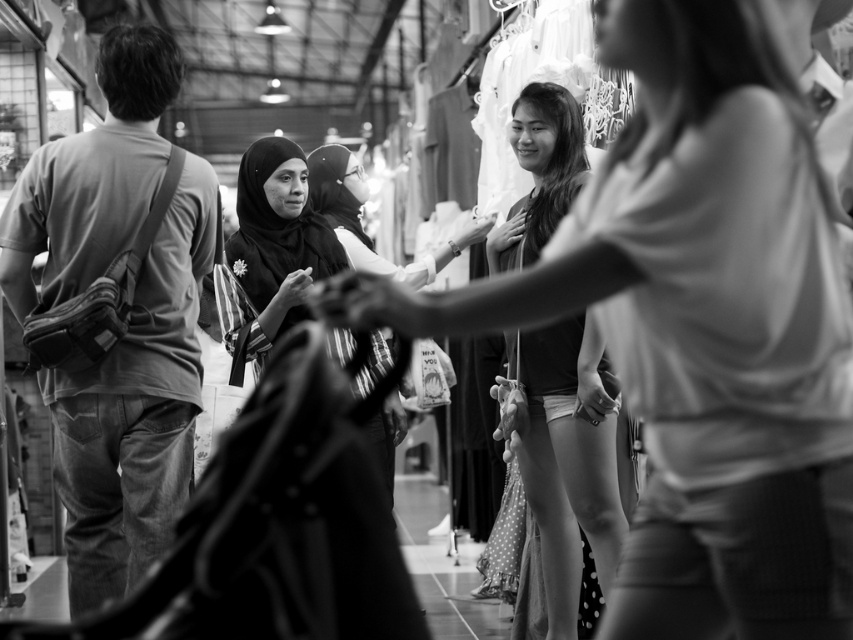
Is denim jeans at left below smooth fabric blouse at center?

Actually, denim jeans at left is above smooth fabric blouse at center.

What do you see at coordinates (136, 410) in the screenshot?
I see `denim jeans at left` at bounding box center [136, 410].

Is point (80, 212) closer to camera compared to point (590, 432)?

Yes, point (80, 212) is closer to viewer.

Where is `denim jeans at left`? The width and height of the screenshot is (853, 640). denim jeans at left is located at coordinates point(136,410).

Can you confirm if smooth fabric blouse at center is shorter than matte black hijab at center?

In fact, smooth fabric blouse at center may be taller than matte black hijab at center.

Who is positioned more to the right, smooth fabric blouse at center or matte black hijab at center?

Positioned to the right is smooth fabric blouse at center.

What do you see at coordinates (569, 468) in the screenshot? The height and width of the screenshot is (640, 853). I see `smooth fabric blouse at center` at bounding box center [569, 468].

You are a GUI agent. You are given a task and a screenshot of the screen. Output one action in this format:
    pyautogui.click(x=<x>, y=<y>)
    Task: Click on the smooth fabric blouse at center
    The width and height of the screenshot is (853, 640).
    Given the screenshot: What is the action you would take?
    [x=569, y=468]

Between denim jeans at left and matte black hijab at center, which one is positioned higher?

matte black hijab at center is above.

Does denim jeans at left have a greater width compared to matte black hijab at center?

Yes.

Between point (117, 400) and point (285, 262), which one is positioned in front?

Point (117, 400)

The image size is (853, 640). I want to click on denim jeans at left, so click(136, 410).